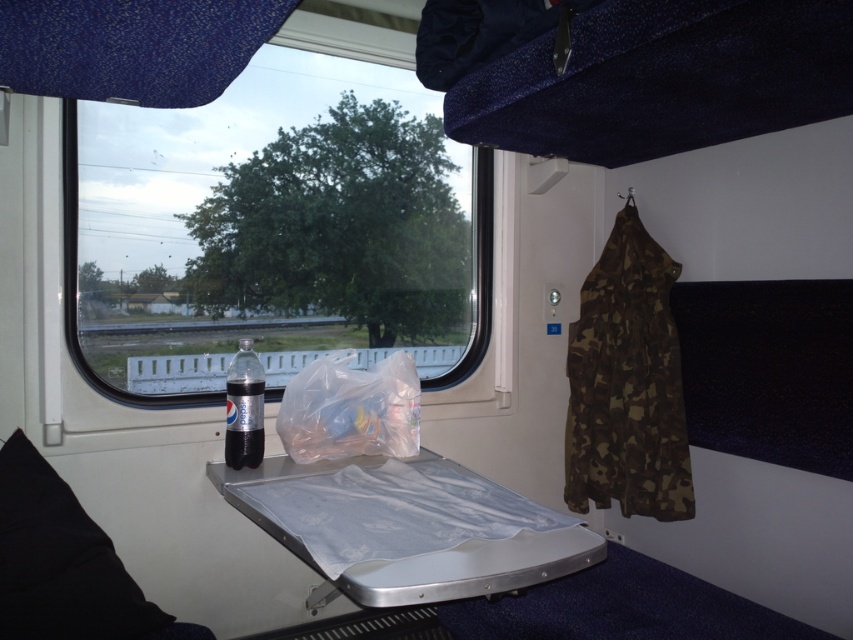
Question: Is blue fabric curtain at upper left to the left of black matte pepsi bottle at lower left from the viewer's perspective?

Choices:
 (A) no
 (B) yes

Answer: (B)

Question: Is blue fabric curtain at upper left bigger than black fabric pillow at lower left?

Choices:
 (A) no
 (B) yes

Answer: (A)

Question: Which object is farther from the camera taking this photo?

Choices:
 (A) black fabric pillow at lower left
 (B) transparent plastic window at center
 (C) blue fabric curtain at upper left

Answer: (B)

Question: Which of the following is the farthest from the observer?

Choices:
 (A) (115, 625)
 (B) (340, 317)
 (C) (381, 422)

Answer: (B)

Question: Which object is farther from the camera taking this photo?

Choices:
 (A) blue fabric curtain at upper left
 (B) translucent plastic bag at center
 (C) transparent plastic window at center
 (D) black fabric pillow at lower left

Answer: (C)

Question: Can you confirm if transparent plastic window at center is thinner than translucent plastic bag at center?

Choices:
 (A) no
 (B) yes

Answer: (B)